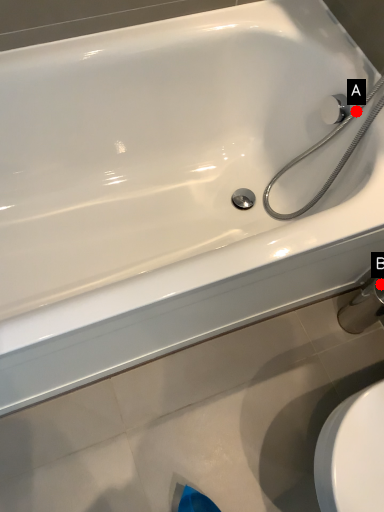
Question: Two points are circled on the image, labeled by A and B beside each circle. Which of the following is the farthest from the observer?

Choices:
 (A) A is further
 (B) B is further

Answer: (B)